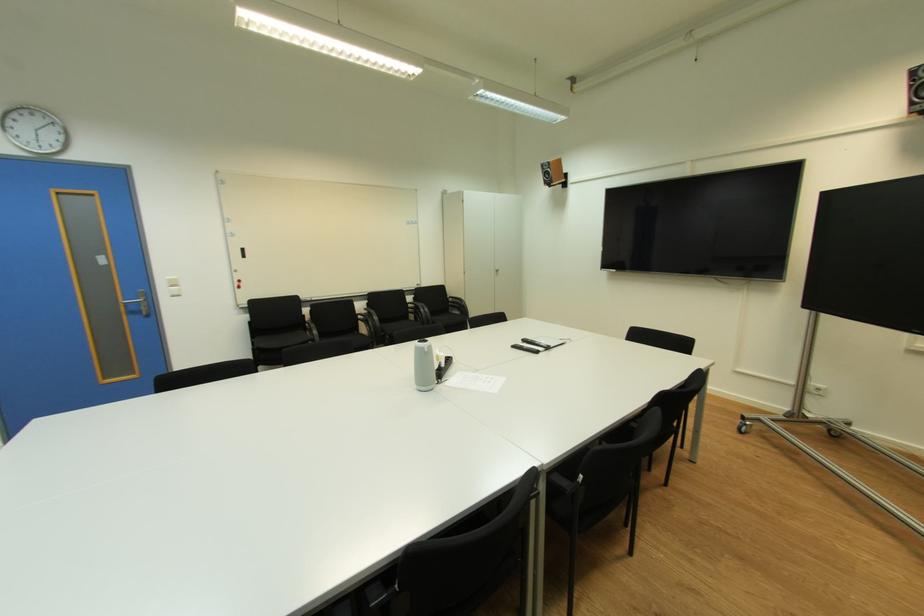
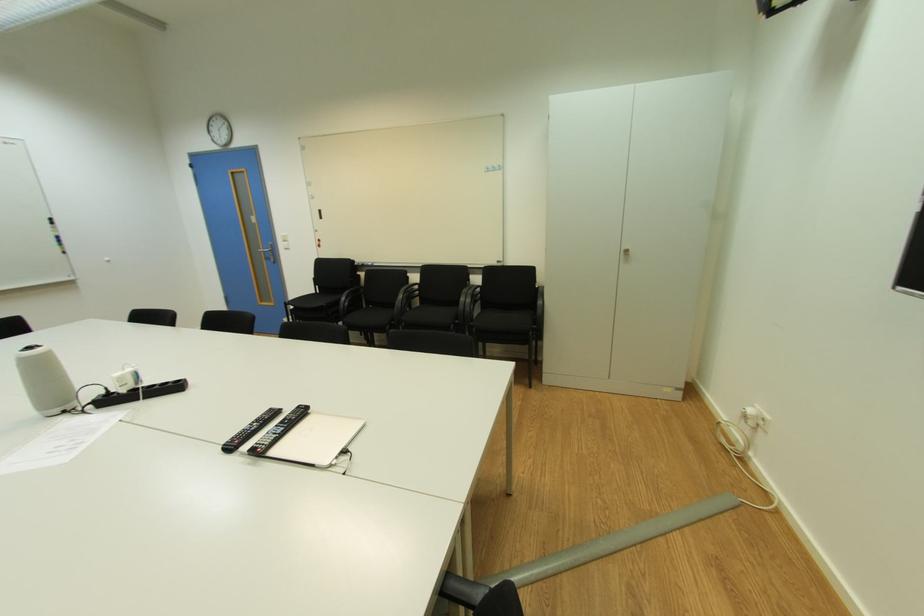
Find the pixel in the second image that matches pixel 502 273 in the first image.

(628, 254)